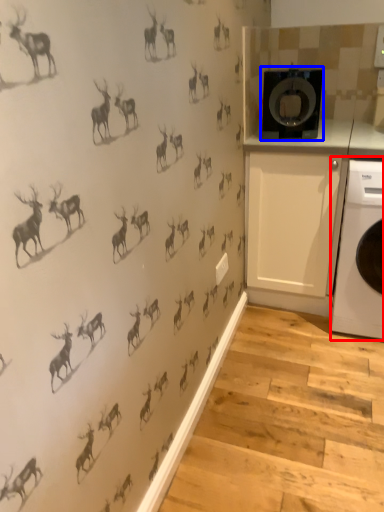
Question: Among these objects, which one is nearest to the camera, home appliance (highlighted by a red box) or washing machine (highlighted by a blue box)?

Choices:
 (A) home appliance
 (B) washing machine

Answer: (A)